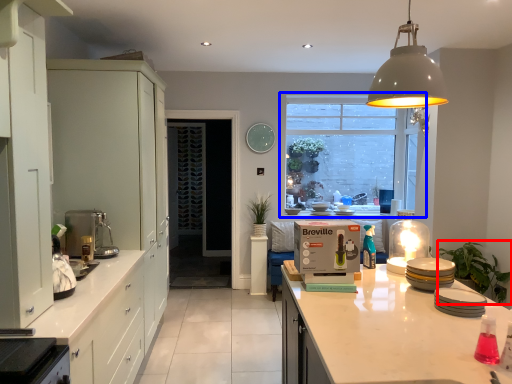
Question: Which point is further to the camera, plant (highlighted by a red box) or window (highlighted by a blue box)?

Choices:
 (A) plant
 (B) window

Answer: (B)